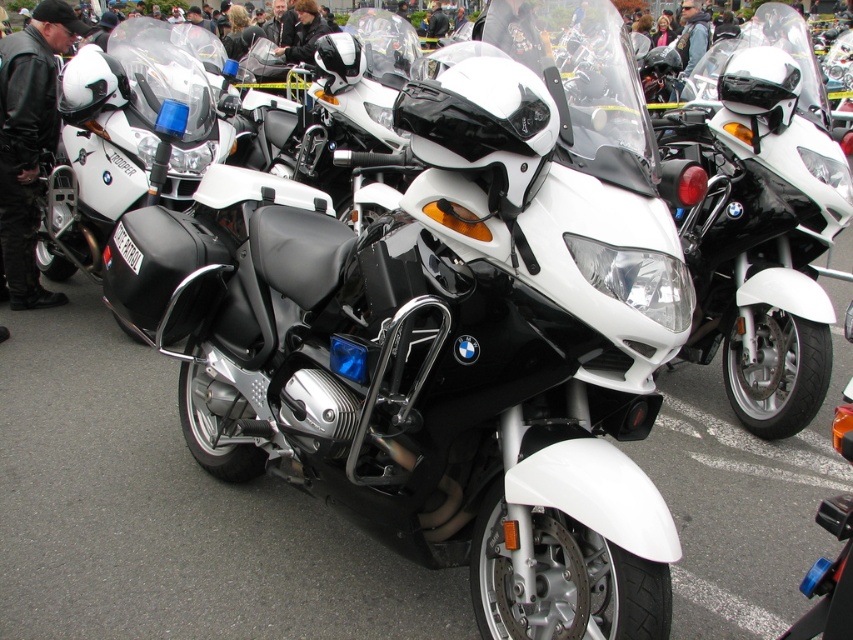
You are a photographer standing at the front of the BMW R1200RT police motorcycle. You want to take a photo of the leather jacket at center. In which direction should you move your camera to capture the jacket in the frame?

The leather jacket at center is located at point 0.222 on the x axis and 0.034 on the y axis. Since the photographer is at the front of the motorcycle, they should move the camera slightly to the right and down to align with the jacket.